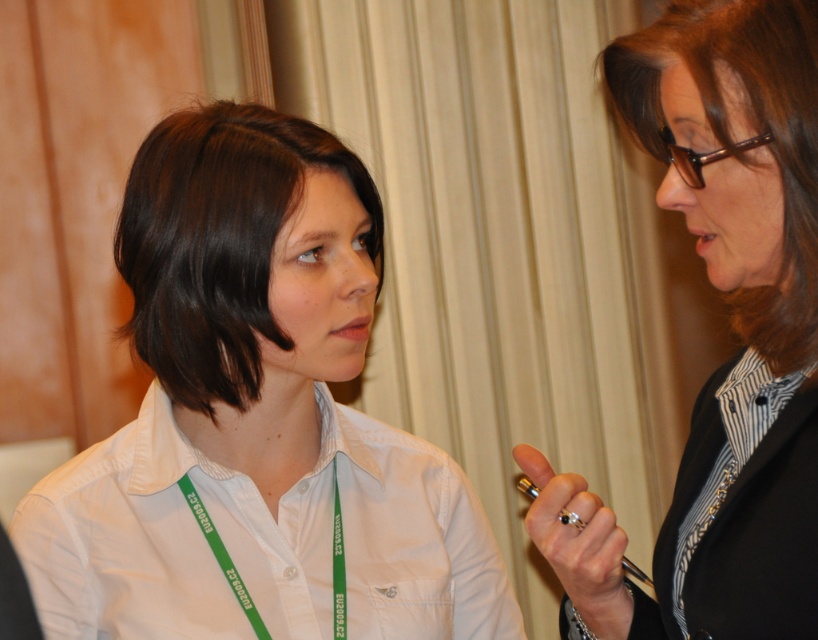
This screenshot has width=818, height=640. Describe the element at coordinates (730, 140) in the screenshot. I see `brown smooth hair at upper right` at that location.

Between brown smooth hair at upper right and green fabric lanyard at center, which one appears on the right side from the viewer's perspective?

Positioned to the right is green fabric lanyard at center.

Where is `brown smooth hair at upper right`? brown smooth hair at upper right is located at coordinates (730, 140).

Locate an element on the screen. Image resolution: width=818 pixels, height=640 pixels. brown smooth hair at upper right is located at coordinates (730, 140).

Is gold metallic pen at center closer to camera compared to green fabric lanyard at center?

No.

Between gold metallic pen at center and green fabric lanyard at center, which one appears on the left side from the viewer's perspective?

Positioned to the left is gold metallic pen at center.

Who is more distant from viewer, (x=536, y=456) or (x=677, y=612)?

The point (x=536, y=456) is behind.

You are a GUI agent. You are given a task and a screenshot of the screen. Output one action in this format:
    pyautogui.click(x=<x>, y=<y>)
    Task: Click on the gold metallic pen at center
    This screenshot has height=640, width=818.
    Given the screenshot: What is the action you would take?
    pyautogui.click(x=578, y=541)

At what (x,y) coordinates should I click in order to perform the action: click on white matte shirt at center. Please return your answer as a coordinate pair (x, y). The image size is (818, 640). Looking at the image, I should click on (255, 419).

Does white matte shirt at center have a greater width compared to brown smooth hair at upper right?

Yes.

Between point (348, 285) and point (771, 74), which one is positioned behind?

Point (348, 285)

I want to click on white matte shirt at center, so click(255, 419).